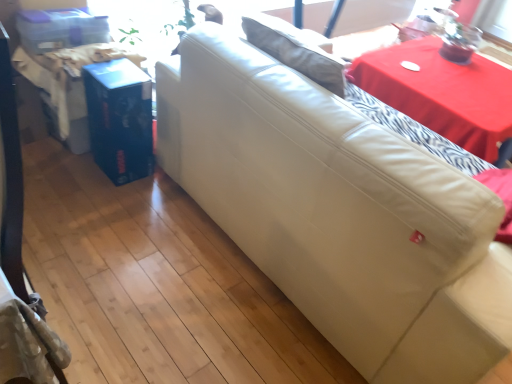
The width and height of the screenshot is (512, 384). What do you see at coordinates (339, 212) in the screenshot?
I see `leather couch at center` at bounding box center [339, 212].

Identify the location of leather couch at center. The width and height of the screenshot is (512, 384). (339, 212).

Measure the distance between point (298, 188) and camera.

They are 4.03 feet apart.

Where is `red fabric table at upper right`? The width and height of the screenshot is (512, 384). red fabric table at upper right is located at coordinates [442, 92].

What do you see at coordinates (442, 92) in the screenshot? The image size is (512, 384). I see `red fabric table at upper right` at bounding box center [442, 92].

Image resolution: width=512 pixels, height=384 pixels. In order to click on leather couch at center in this screenshot , I will do `click(339, 212)`.

Between leather couch at center and red fabric table at upper right, which one appears on the left side from the viewer's perspective?

Positioned to the left is leather couch at center.

Who is more distant, leather couch at center or red fabric table at upper right?

red fabric table at upper right is more distant.

Considering the positions of points (179, 117) and (510, 100), is point (179, 117) farther from camera compared to point (510, 100)?

No.

From the image's perspective, which object appears higher, leather couch at center or red fabric table at upper right?

red fabric table at upper right, from the image's perspective.

From a real-world perspective, is leather couch at center above or below red fabric table at upper right?

leather couch at center is situated higher than red fabric table at upper right in the real world.

Is leather couch at center wider than red fabric table at upper right?

Yes, leather couch at center is wider than red fabric table at upper right.

In the scene shown: Between leather couch at center and red fabric table at upper right, which one has less height?

With less height is red fabric table at upper right.

Considering the sizes of leather couch at center and red fabric table at upper right in the image, is leather couch at center bigger or smaller than red fabric table at upper right?

Considering their sizes, leather couch at center takes up more space than red fabric table at upper right.

Is leather couch at center situated inside red fabric table at upper right or outside?

leather couch at center is spatially situated outside red fabric table at upper right.

Is leather couch at center positioned far away from red fabric table at upper right?

That's right, there is a large distance between leather couch at center and red fabric table at upper right.

Is leather couch at center facing towards red fabric table at upper right?

Yes, leather couch at center faces towards red fabric table at upper right.

How many degrees apart are the facing directions of leather couch at center and red fabric table at upper right?

leather couch at center and red fabric table at upper right are facing 89.9 degrees away from each other.

The width and height of the screenshot is (512, 384). Find the location of `table on the right of leather couch at center`. table on the right of leather couch at center is located at coordinates (442, 92).

Would you say red fabric table at upper right is to the left or to the right of leather couch at center in the picture?

red fabric table at upper right is positioned on leather couch at center's right side.

Is red fabric table at upper right positioned before leather couch at center?

No, red fabric table at upper right is behind leather couch at center.

Is point (498, 68) closer to camera compared to point (247, 49)?

No, (498, 68) is further to viewer.

From the image's perspective, between red fabric table at upper right and leather couch at center, which one is located above?

red fabric table at upper right, from the image's perspective.

From a real-world perspective, is red fabric table at upper right below leather couch at center?

Correct, in the physical world, red fabric table at upper right is lower than leather couch at center.

In terms of width, does red fabric table at upper right look wider or thinner when compared to leather couch at center?

red fabric table at upper right is thinner than leather couch at center.

Which of these two, red fabric table at upper right or leather couch at center, stands shorter?

Standing shorter between the two is red fabric table at upper right.

Between red fabric table at upper right and leather couch at center, which one has smaller size?

Smaller between the two is red fabric table at upper right.

Is red fabric table at upper right situated inside leather couch at center or outside?

red fabric table at upper right is spatially situated outside leather couch at center.

Is red fabric table at upper right not near leather couch at center?

Yes, red fabric table at upper right is far from leather couch at center.

Does red fabric table at upper right turn towards leather couch at center?

No, red fabric table at upper right does not turn towards leather couch at center.

Can you tell me how much red fabric table at upper right and leather couch at center differ in facing direction?

There is a 89.9-degree angle between the facing directions of red fabric table at upper right and leather couch at center.

The height and width of the screenshot is (384, 512). I want to click on table located above the leather couch at center (from the image's perspective), so click(442, 92).

Identify the location of table behind the leather couch at center. (442, 92).

Locate an element on the screen. The height and width of the screenshot is (384, 512). table on the right of leather couch at center is located at coordinates (442, 92).